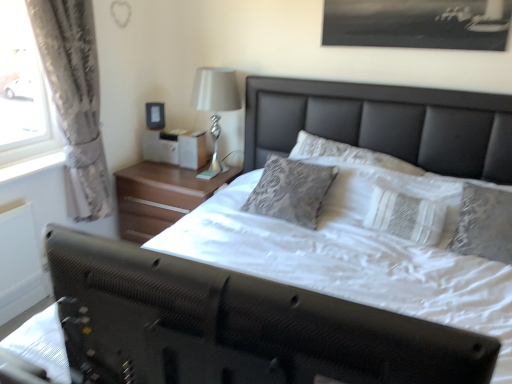
At what (x,y) coordinates should I click in order to perform the action: click on unoccupied space behind matte black picture frame at upper center. Please return your answer as a coordinate pair (x, y). Image resolution: width=512 pixels, height=384 pixels. Looking at the image, I should click on (158, 129).